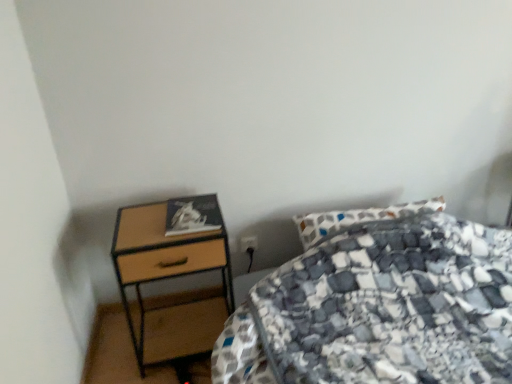
Question: From the image's perspective, relative to black plastic power plug at lower center, is patterned fabric bed at center above or below?

Choices:
 (A) above
 (B) below

Answer: (B)

Question: In terms of height, does patterned fabric bed at center look taller or shorter compared to black plastic power plug at lower center?

Choices:
 (A) short
 (B) tall

Answer: (B)

Question: Based on their relative distances, which object is nearer to the patterned fabric bed at center?

Choices:
 (A) black plastic power plug at lower center
 (B) woodenmaterial/texturenightstand at left

Answer: (B)

Question: Estimate the real-world distances between objects in this image. Which object is farther from the patterned fabric bed at center?

Choices:
 (A) woodenmaterial/texturenightstand at left
 (B) black plastic power plug at lower center

Answer: (B)